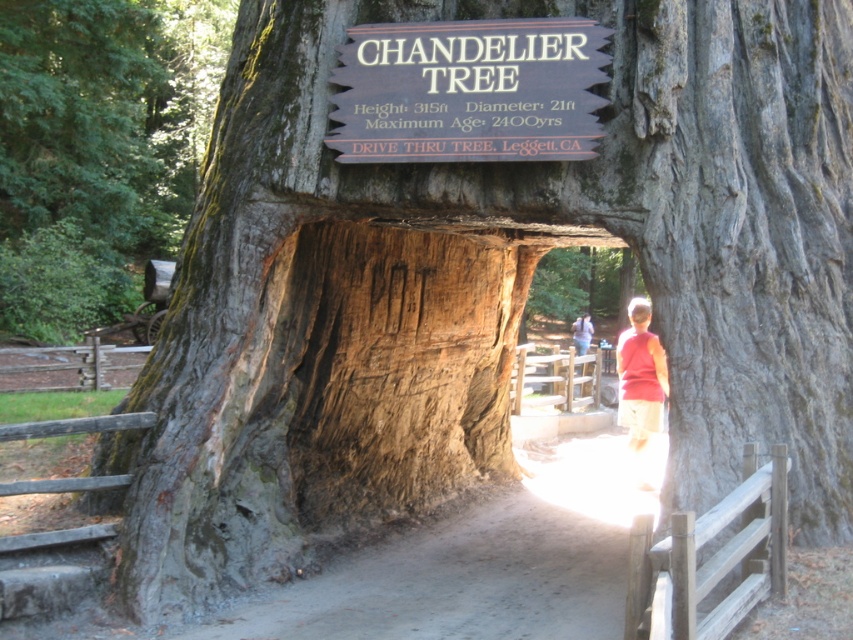
Question: Does smooth bark tree at center have a smaller size compared to red cotton shirt at center?

Choices:
 (A) no
 (B) yes

Answer: (B)

Question: Among these points, which one is farthest from the camera?

Choices:
 (A) (643, 432)
 (B) (183, 116)
 (C) (378, 113)

Answer: (B)

Question: Which object appears farthest from the camera in this image?

Choices:
 (A) wooden sign at center
 (B) smooth bark tree at center

Answer: (B)

Question: Does wooden sign at center have a larger size compared to red shirt at center?

Choices:
 (A) no
 (B) yes

Answer: (B)

Question: Among these points, which one is farthest from the camera?

Choices:
 (A) (437, 99)
 (B) (585, 314)

Answer: (B)

Question: Is wooden sign at center behind red cotton shirt at center?

Choices:
 (A) yes
 (B) no

Answer: (B)